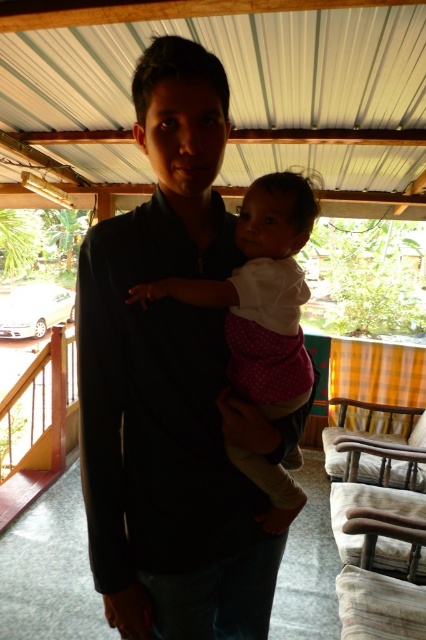
Can you confirm if dark blue shirt at center is smaller than white polka dot fabric at center?

No, dark blue shirt at center is not smaller than white polka dot fabric at center.

Can you confirm if dark blue shirt at center is positioned below white polka dot fabric at center?

Result: Yes.

Who is more distant from viewer, (167, 42) or (262, 408)?

Point (262, 408)

This screenshot has width=426, height=640. I want to click on dark blue shirt at center, so click(172, 385).